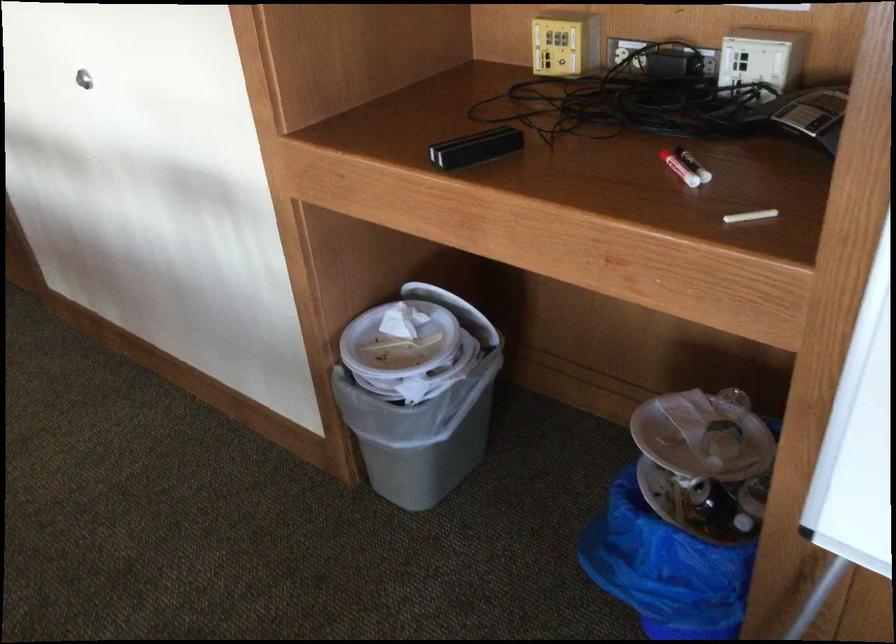
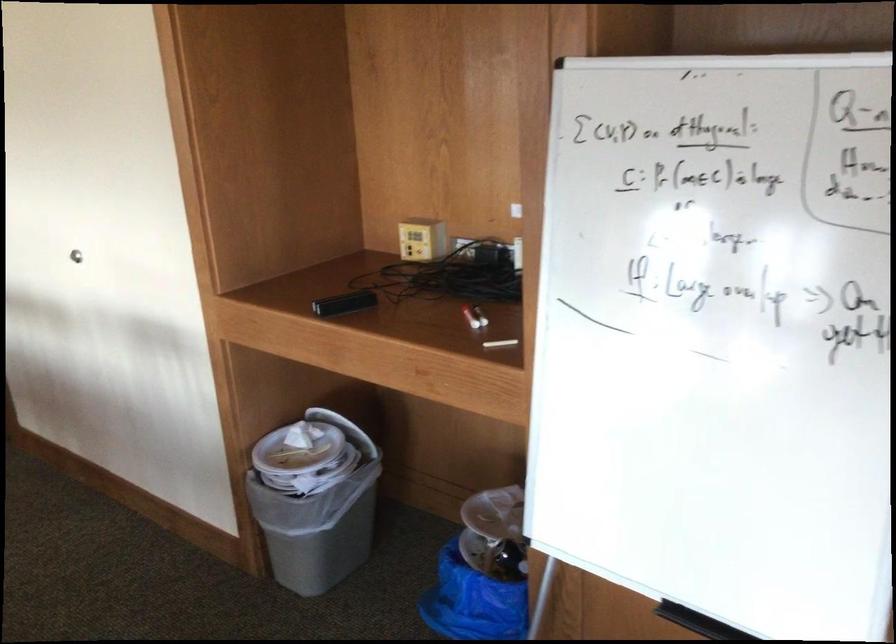
Where in the second image is the point corresponding to the point at 478,149 from the first image?

(343, 303)